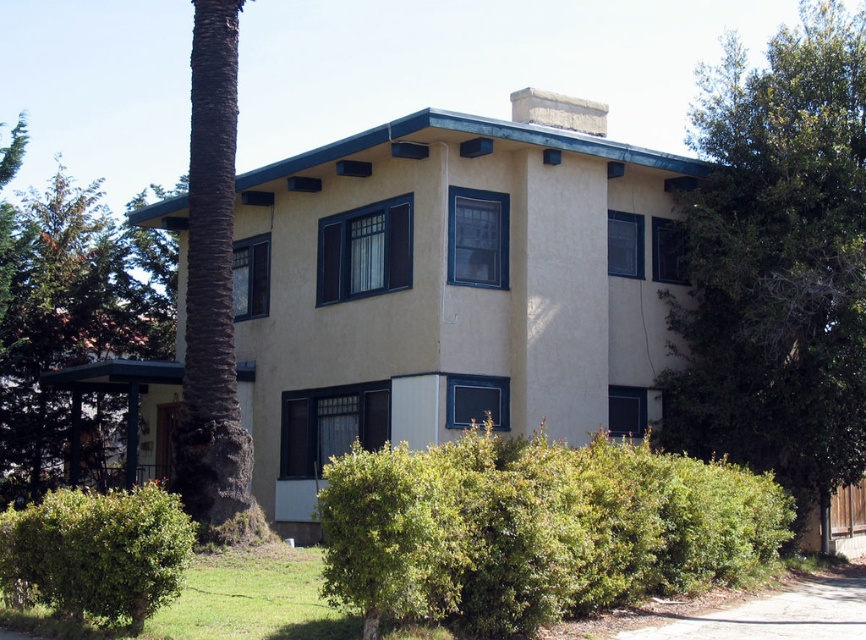
You are planning to install a new sprinkler system in the lawn. The sprinkler can water an area within a 20 meter radius. If you place the sprinkler at the green leafy bush at lower left, will it reach the green leafy tree at left?

The green leafy tree at left is 26.06 meters from the green leafy bush at lower left. Since the sprinkler can only water up to 20 meters, it will not reach the green leafy tree at left.

You are standing at the front door of the two story residential building. You see a point labeled point (779, 262). Where is this point located in relation to the green leafy tree at right?

The point (779, 262) corresponds to the green leafy tree at right, so it is located at that tree.

You are standing at the front door of the house and looking towards the lawn. There are two points marked on the ground in front of you. One is at point (65, 182) and the other is at point (20, 513). Which point is closer to you?

Point (20, 513) is closer to you because it is in front of point (65, 182).